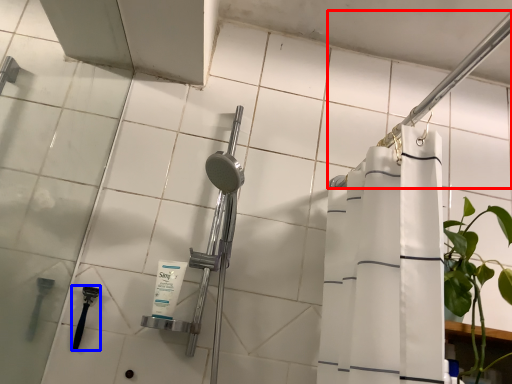
Question: Which of the following is the closest to the observer, shower (highlighted by a red box) or shower (highlighted by a blue box)?

Choices:
 (A) shower
 (B) shower

Answer: (A)